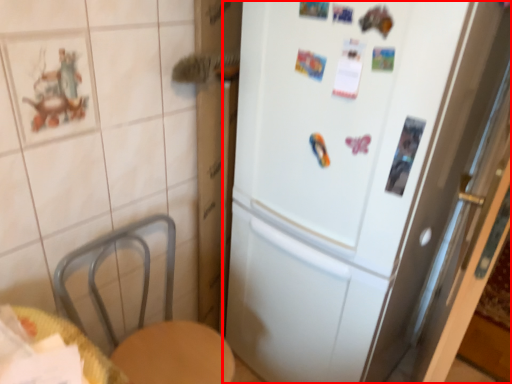
Question: From the image's perspective, what is the correct spatial positioning of refrigerator (annotated by the red box) in reference to table?

Choices:
 (A) above
 (B) below

Answer: (A)